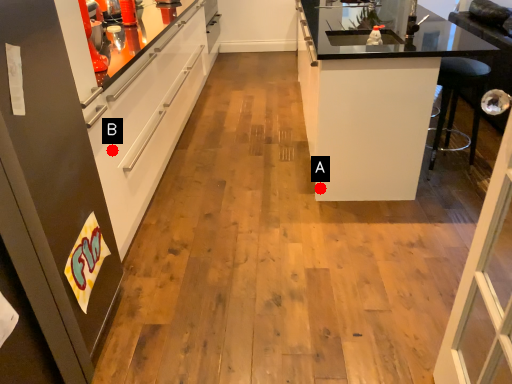
Question: Two points are circled on the image, labeled by A and B beside each circle. Which point appears closest to the camera in this image?

Choices:
 (A) A is closer
 (B) B is closer

Answer: (B)